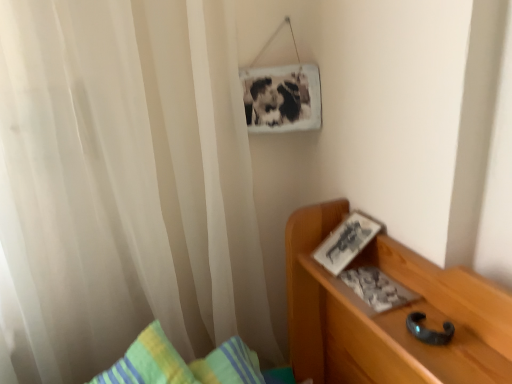
Measure the distance between point (365, 278) and camera.

Point (365, 278) is 34.13 inches from camera.

Locate an element on the screen. The height and width of the screenshot is (384, 512). white paper book at right is located at coordinates (377, 288).

Describe the element at coordinates (377, 288) in the screenshot. I see `white paper book at right` at that location.

What do you see at coordinates (125, 184) in the screenshot?
I see `white sheer curtain at left` at bounding box center [125, 184].

Measure the distance between white sheer curtain at left and camera.

The depth of white sheer curtain at left is 79.08 centimeters.

This screenshot has height=384, width=512. Find the location of `white sheer curtain at left`. white sheer curtain at left is located at coordinates (125, 184).

What is the approximate height of white sheer curtain at left?

It is 36.98 inches.

This screenshot has height=384, width=512. Find the location of `white paper book at right`. white paper book at right is located at coordinates click(377, 288).

Which is more to the left, white paper book at right or white sheer curtain at left?

Positioned to the left is white sheer curtain at left.

Relative to white sheer curtain at left, is white paper book at right in front or behind?

Visually, white paper book at right is located behind white sheer curtain at left.

Which is less distant, (374,299) or (192,28)?

Point (374,299) is positioned closer to the camera compared to point (192,28).

From the image's perspective, which is below, white paper book at right or white sheer curtain at left?

white paper book at right, from the image's perspective.

From a real-world perspective, is white paper book at right over white sheer curtain at left?

No.

Does white paper book at right have a greater width compared to white sheer curtain at left?

No, white paper book at right is not wider than white sheer curtain at left.

Which of these two, white paper book at right or white sheer curtain at left, stands taller?

With more height is white sheer curtain at left.

Between white paper book at right and white sheer curtain at left, which one has larger size?

With larger size is white sheer curtain at left.

Consider the image. Would you say white paper book at right contains white sheer curtain at left?

No, white sheer curtain at left is not inside white paper book at right.

Are white paper book at right and white sheer curtain at left beside each other?

No, white paper book at right is not making contact with white sheer curtain at left.

In the scene shown: Is white paper book at right turned away from white sheer curtain at left?

No, white paper book at right is not facing away from white sheer curtain at left.

What's the angular difference between white paper book at right and white sheer curtain at left's facing directions?

white paper book at right and white sheer curtain at left are facing 86.9 degrees away from each other.

Find the location of a particular element. The height and width of the screenshot is (384, 512). book below the white sheer curtain at left (from the image's perspective) is located at coordinates (377, 288).

Based on the photo, does white sheer curtain at left appear on the right side of white paper book at right?

In fact, white sheer curtain at left is to the left of white paper book at right.

Which object is closer to the camera taking this photo, white sheer curtain at left or white paper book at right?

white sheer curtain at left.

Is point (77, 85) positioned before point (352, 279)?

That is False.

From the image's perspective, which is below, white sheer curtain at left or white paper book at right?

From the image's view, white paper book at right is below.

From a real-world perspective, who is located lower, white sheer curtain at left or white paper book at right?

In real-world perspective, white paper book at right is lower.

From the picture: Which object is thinner, white sheer curtain at left or white paper book at right?

Thinner between the two is white paper book at right.

Does white sheer curtain at left have a lesser height compared to white paper book at right?

In fact, white sheer curtain at left may be taller than white paper book at right.

Considering the sizes of objects white sheer curtain at left and white paper book at right in the image provided, who is smaller, white sheer curtain at left or white paper book at right?

Smaller between the two is white paper book at right.

Can white paper book at right be found inside white sheer curtain at left?

That's incorrect, white paper book at right is not inside white sheer curtain at left.

Is white sheer curtain at left not near white paper book at right?

No.

Is white sheer curtain at left looking in the opposite direction of white paper book at right?

That's not correct — white sheer curtain at left is not looking away from white paper book at right.

How different are the orientations of white sheer curtain at left and white paper book at right in degrees?

The angular difference between white sheer curtain at left and white paper book at right is 86.9 degrees.

How distant is white sheer curtain at left from white paper book at right?

white sheer curtain at left is 21.63 inches from white paper book at right.

At what (x,y) coordinates should I click in order to perform the action: click on curtain on the left side of white paper book at right. Please return your answer as a coordinate pair (x, y). This screenshot has height=384, width=512. Looking at the image, I should click on (125, 184).

Where is `curtain in front of the white paper book at right`? Image resolution: width=512 pixels, height=384 pixels. curtain in front of the white paper book at right is located at coordinates (125, 184).

Identify the location of book located underneath the white sheer curtain at left (from a real-world perspective). This screenshot has height=384, width=512. (377, 288).